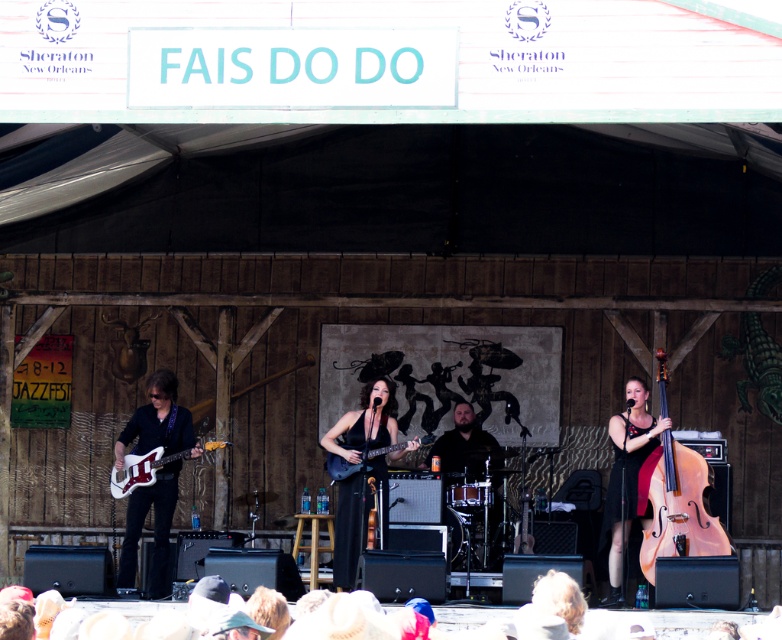
Between glossy white guitar at left and matte black electric guitar at center, which one appears on the left side from the viewer's perspective?

Positioned to the left is glossy white guitar at left.

Is point (189, 426) farther from viewer compared to point (335, 468)?

Yes, it is.

The width and height of the screenshot is (782, 640). What are the coordinates of `glossy white guitar at left` in the screenshot? It's located at (153, 529).

Between black matte guitar at center and matte black dress at center, which one is positioned higher?

black matte guitar at center

Looking at this image, is black matte guitar at center shorter than matte black dress at center?

Indeed, black matte guitar at center has a lesser height compared to matte black dress at center.

Between point (368, 417) and point (619, 509), which one is positioned behind?

The point (368, 417) is more distant.

The width and height of the screenshot is (782, 640). Find the location of `black matte guitar at center`. black matte guitar at center is located at coordinates (363, 422).

Is black matte guitar at center smaller than white glossy electric guitar at lower left?

Actually, black matte guitar at center might be larger than white glossy electric guitar at lower left.

This screenshot has width=782, height=640. Describe the element at coordinates (363, 422) in the screenshot. I see `black matte guitar at center` at that location.

Between point (346, 500) and point (138, 458), which one is positioned behind?

The point (138, 458) is more distant.

Locate an element on the screen. The width and height of the screenshot is (782, 640). black matte guitar at center is located at coordinates (363, 422).